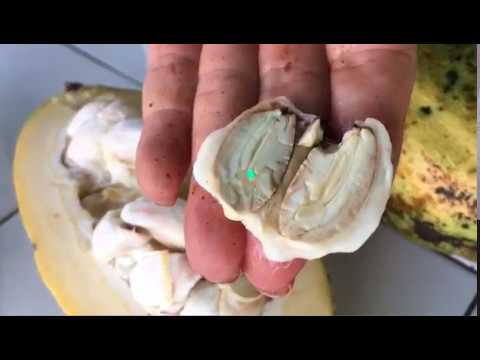
You are a GUI agent. You are given a task and a screenshot of the screen. Output one action in this format:
    pyautogui.click(x=<x>, y=<y>)
    Task: Click on the tiled surface
    
    Given the screenshot: What is the action you would take?
    pyautogui.click(x=397, y=284)